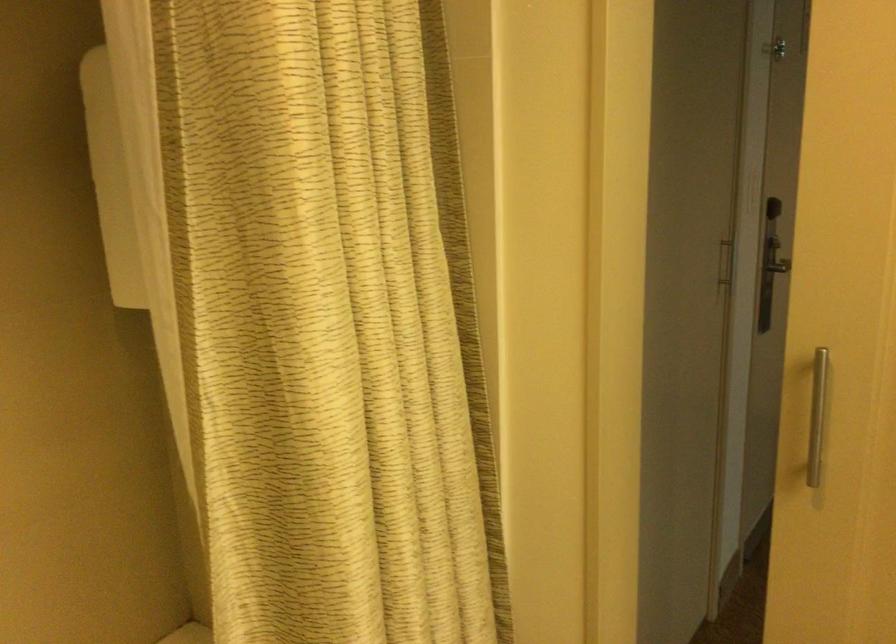
Locate an element on the screen. Image resolution: width=896 pixels, height=644 pixels. door deadbolt knob is located at coordinates (773, 254).